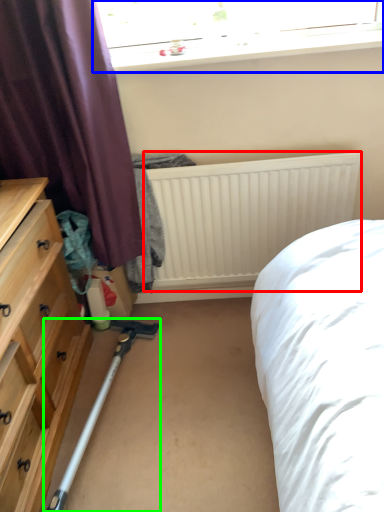
Question: Which object is the farthest from radiator (highlighted by a red box)? Choose among these: window (highlighted by a blue box) or equipment (highlighted by a green box).

Choices:
 (A) window
 (B) equipment

Answer: (B)